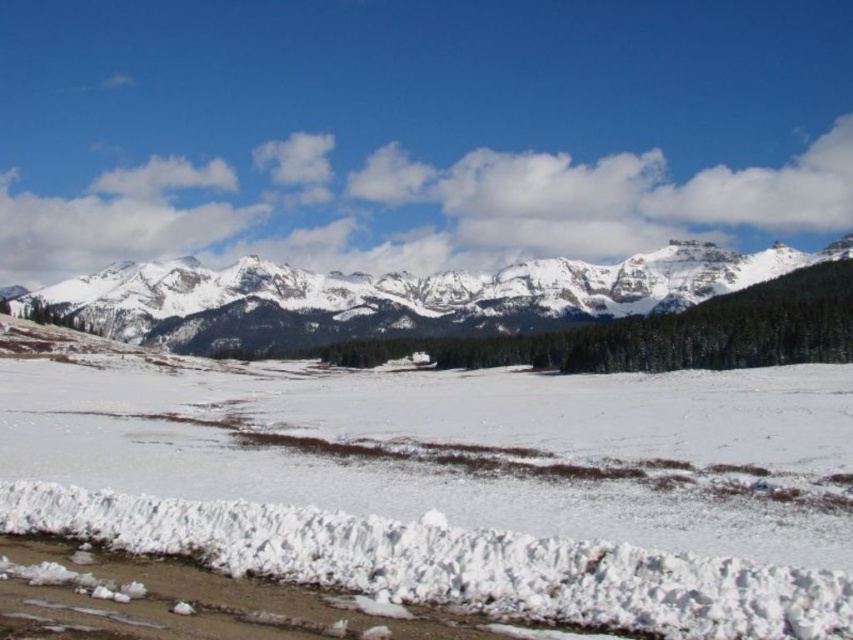
Does white snow at center have a lesser width compared to white snow-covered mountain range at upper center?

Correct, white snow at center's width is less than white snow-covered mountain range at upper center's.

Which is behind, point (672, 529) or point (329, 321)?

Positioned behind is point (329, 321).

Describe the element at coordinates (463, 484) in the screenshot. I see `white snow at center` at that location.

Where is `white snow at center`? Image resolution: width=853 pixels, height=640 pixels. white snow at center is located at coordinates (463, 484).